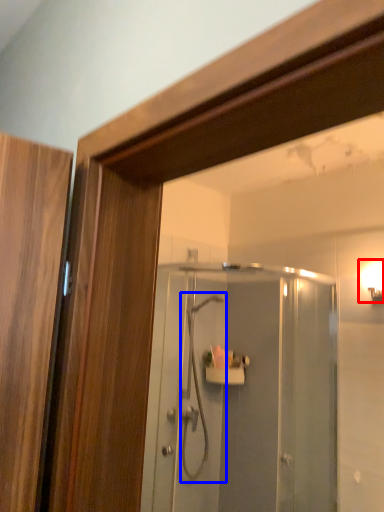
Question: Which of the following is the farthest to the observer, light fixture (highlighted by a red box) or shower (highlighted by a blue box)?

Choices:
 (A) light fixture
 (B) shower

Answer: (B)